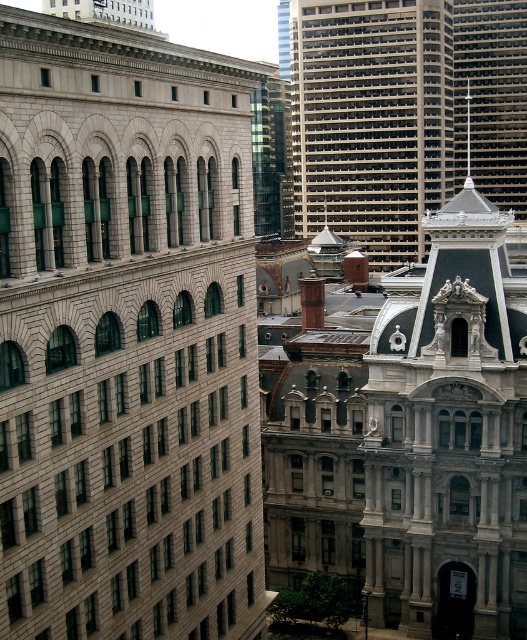
Question: Which point is closer to the camera?

Choices:
 (A) [x=516, y=36]
 (B) [x=466, y=134]
 (C) [x=104, y=232]

Answer: (C)

Question: Considering the real-world distances, which object is farthest from the smooth gray spire at upper right?

Choices:
 (A) gray stone building at left
 (B) gray concrete skyscraper at upper center

Answer: (A)

Question: Which point is closer to the camera?

Choices:
 (A) (466, 92)
 (B) (518, 120)

Answer: (B)

Question: Is gray stone building at left above gray concrete skyscraper at upper center?

Choices:
 (A) no
 (B) yes

Answer: (A)

Question: Does gray stone building at left lie in front of smooth gray spire at upper right?

Choices:
 (A) no
 (B) yes

Answer: (B)

Question: Considering the relative positions of gray stone building at left and smooth gray spire at upper right in the image provided, where is gray stone building at left located with respect to smooth gray spire at upper right?

Choices:
 (A) above
 (B) below

Answer: (B)